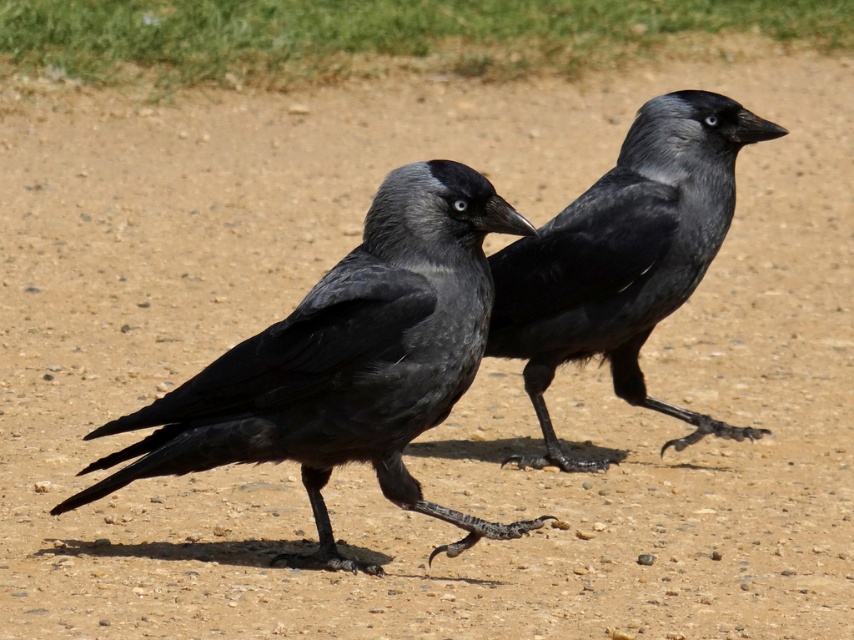
Question: Among these points, which one is farthest from the camera?

Choices:
 (A) (638, 314)
 (B) (439, 512)

Answer: (A)

Question: Can you confirm if matte black raven at center is wider than shiny black raven at center?

Choices:
 (A) no
 (B) yes

Answer: (B)

Question: Is matte black raven at center positioned before shiny black raven at center?

Choices:
 (A) yes
 (B) no

Answer: (A)

Question: Does matte black raven at center appear over shiny black raven at center?

Choices:
 (A) no
 (B) yes

Answer: (A)

Question: Which point is farther to the camera?

Choices:
 (A) (196, 429)
 (B) (763, 129)

Answer: (B)